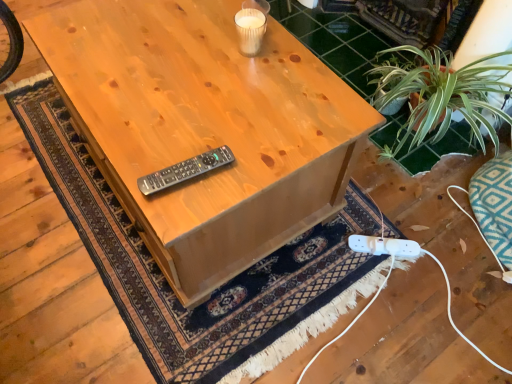
Locate an element on the screen. This screenshot has height=384, width=512. vacant space in between natural wood table at center and white plastic plug at lower right is located at coordinates (320, 254).